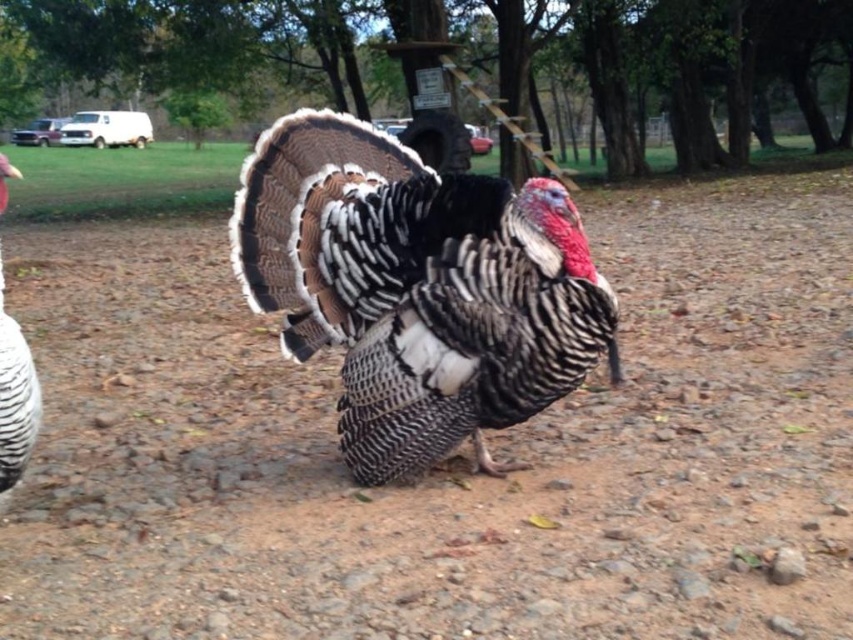
Can you confirm if brown textured dirt at center is positioned to the left of speckled feathered turkey at center?

Yes, brown textured dirt at center is to the left of speckled feathered turkey at center.

Can you confirm if brown textured dirt at center is positioned above speckled feathered turkey at center?

No.

Locate an element on the screen. brown textured dirt at center is located at coordinates (451, 460).

Is point (630, 563) closer to viewer compared to point (24, 413)?

That is False.

Can you confirm if brown textured dirt at center is taller than white feathered turkey at left?

In fact, brown textured dirt at center may be shorter than white feathered turkey at left.

Find the location of a particular element. brown textured dirt at center is located at coordinates (451, 460).

Can you confirm if speckled feathered turkey at center is smaller than white feathered turkey at left?

No, speckled feathered turkey at center is not smaller than white feathered turkey at left.

Is point (320, 248) farther from camera compared to point (6, 333)?

Yes, it is behind point (6, 333).

Identify the location of speckled feathered turkey at center. The width and height of the screenshot is (853, 640). (416, 289).